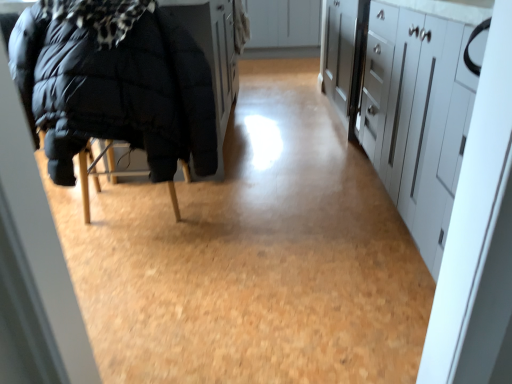
Question: Does white matte cabinet at upper center, which is counted as the second cabinetry, starting from the bottom, have a greater width compared to black puffy jacket at left?

Choices:
 (A) no
 (B) yes

Answer: (B)

Question: From the image's perspective, is white matte cabinet at upper center, the second cabinetry when ordered from front to back, under black puffy jacket at left?

Choices:
 (A) no
 (B) yes

Answer: (A)

Question: Does white matte cabinet at upper center, the 1th cabinetry positioned from the back, lie behind black puffy jacket at left?

Choices:
 (A) no
 (B) yes

Answer: (B)

Question: Can you confirm if white matte cabinet at upper center, the 1th cabinetry positioned from the back, is thinner than black puffy jacket at left?

Choices:
 (A) yes
 (B) no

Answer: (B)

Question: Is white matte cabinet at upper center, the 1th cabinetry positioned from the back, bigger than black puffy jacket at left?

Choices:
 (A) no
 (B) yes

Answer: (B)

Question: From a real-world perspective, is white matte cabinet at upper center, the 1th cabinetry positioned from the back, on top of black puffy jacket at left?

Choices:
 (A) no
 (B) yes

Answer: (A)

Question: Is white matte cabinet at upper center, the second cabinetry when ordered from front to back, facing towards white glossy cabinets at right, arranged as the 2th cabinetry when viewed from the top?

Choices:
 (A) yes
 (B) no

Answer: (A)

Question: Does white matte cabinet at upper center, which is counted as the second cabinetry, starting from the bottom, come behind white glossy cabinets at right, the first cabinetry from the front?

Choices:
 (A) yes
 (B) no

Answer: (A)

Question: From the image's perspective, would you say white matte cabinet at upper center, placed as the 1th cabinetry when sorted from top to bottom, is shown under white glossy cabinets at right, which is the first cabinetry in bottom-to-top order?

Choices:
 (A) no
 (B) yes

Answer: (A)

Question: Is white glossy cabinets at right, arranged as the 2th cabinetry when viewed from the top, at the back of white matte cabinet at upper center, which is counted as the second cabinetry, starting from the bottom?

Choices:
 (A) no
 (B) yes

Answer: (A)

Question: Does white matte cabinet at upper center, placed as the 1th cabinetry when sorted from top to bottom, touch white glossy cabinets at right, which is the first cabinetry in bottom-to-top order?

Choices:
 (A) no
 (B) yes

Answer: (A)

Question: Is white matte cabinet at upper center, placed as the 1th cabinetry when sorted from top to bottom, outside of white glossy cabinets at right, which is the first cabinetry in bottom-to-top order?

Choices:
 (A) no
 (B) yes

Answer: (B)

Question: From a real-world perspective, does white glossy cabinets at right, the first cabinetry from the front, stand above black puffy jacket at left?

Choices:
 (A) no
 (B) yes

Answer: (A)